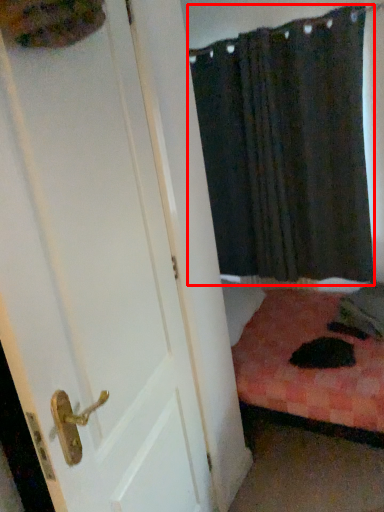
Question: Observing the image, what is the correct spatial positioning of curtain (annotated by the red box) in reference to door?

Choices:
 (A) right
 (B) left

Answer: (A)